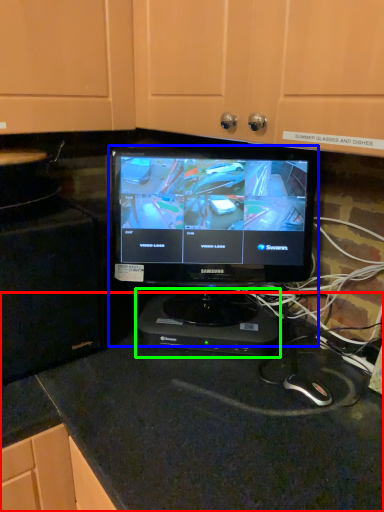
Question: Which object is the closest to the counter top (highlighted by a red box)? Choose among these: computer monitor (highlighted by a blue box) or appliance (highlighted by a green box).

Choices:
 (A) computer monitor
 (B) appliance

Answer: (B)